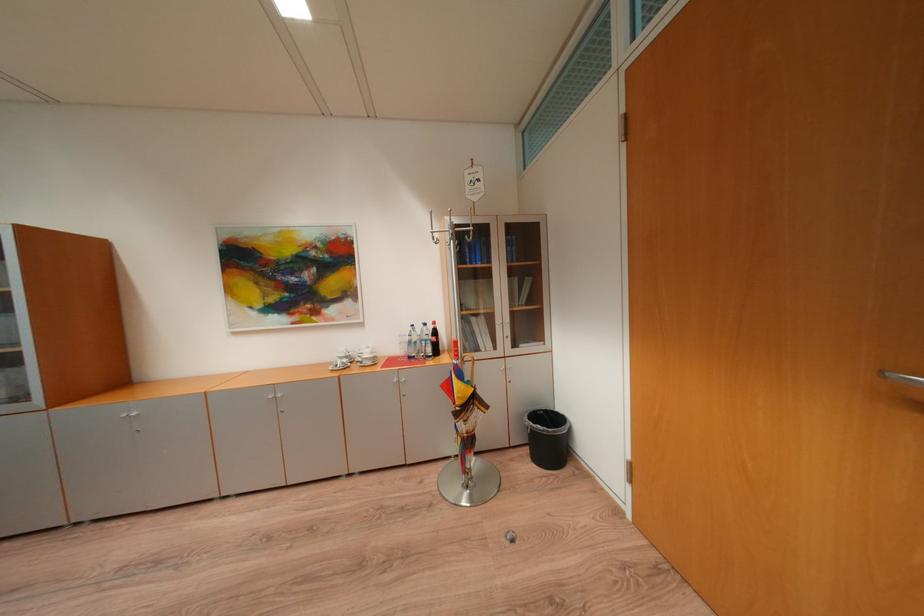
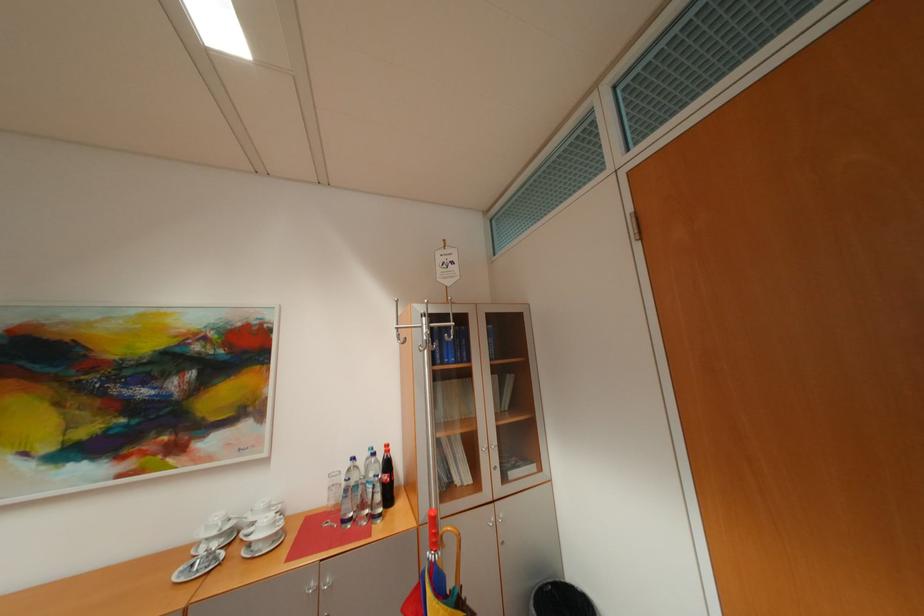
Question: The images are taken continuously from a first-person perspective. In which direction is your viewpoint rotating?

Choices:
 (A) Left
 (B) Right
 (C) Up
 (D) Down

Answer: (C)